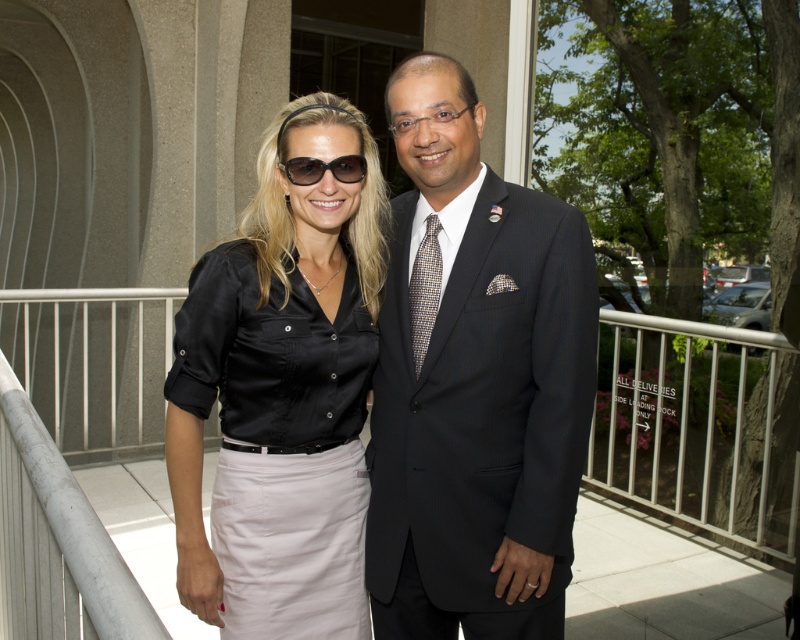
Question: Based on their relative distances, which object is nearer to the multicolored woven tie at center?

Choices:
 (A) sunglasses at center
 (B) dark pinstripe suit at center

Answer: (B)

Question: Can you confirm if multicolored woven tie at center is wider than sunglasses at center?

Choices:
 (A) yes
 (B) no

Answer: (B)

Question: Can you confirm if dark pinstripe suit at center is smaller than satin black blouse at center?

Choices:
 (A) yes
 (B) no

Answer: (A)

Question: Which of the following is the closest to the observer?

Choices:
 (A) click(x=196, y=276)
 (B) click(x=302, y=180)

Answer: (A)

Question: Which of the following is the closest to the observer?

Choices:
 (A) (216, 538)
 (B) (574, 342)

Answer: (B)

Question: Considering the relative positions of dark pinstripe suit at center and sunglasses at center in the image provided, where is dark pinstripe suit at center located with respect to sunglasses at center?

Choices:
 (A) below
 (B) above

Answer: (A)